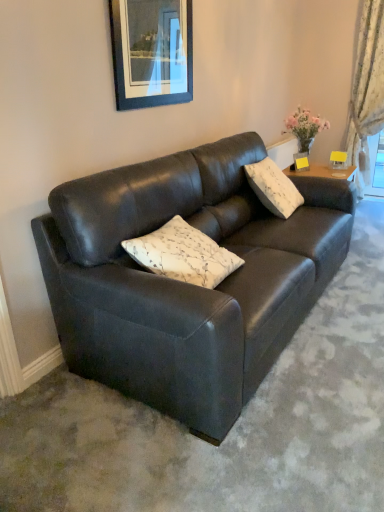
Question: Is white floral-patterned cushion at center, positioned as the second pillow in back-to-front order, to the left or to the right of matte black couch at center in the image?

Choices:
 (A) right
 (B) left

Answer: (B)

Question: Does point (172, 278) appear closer or farther from the camera than point (203, 202)?

Choices:
 (A) farther
 (B) closer

Answer: (B)

Question: Which object is the closest to the matte black picture frame at upper center?

Choices:
 (A) white floral fabric curtain at right
 (B) matte black couch at center
 (C) white floral-patterned cushion at center, positioned as the second pillow in back-to-front order
 (D) white textured pillow at upper right, which is the 1th pillow from top to bottom

Answer: (B)

Question: Which object is the farthest from the matte black picture frame at upper center?

Choices:
 (A) white floral-patterned cushion at center, placed as the second pillow when sorted from top to bottom
 (B) matte black couch at center
 (C) white floral fabric curtain at right
 (D) white textured pillow at upper right, which is counted as the second pillow, starting from the front

Answer: (C)